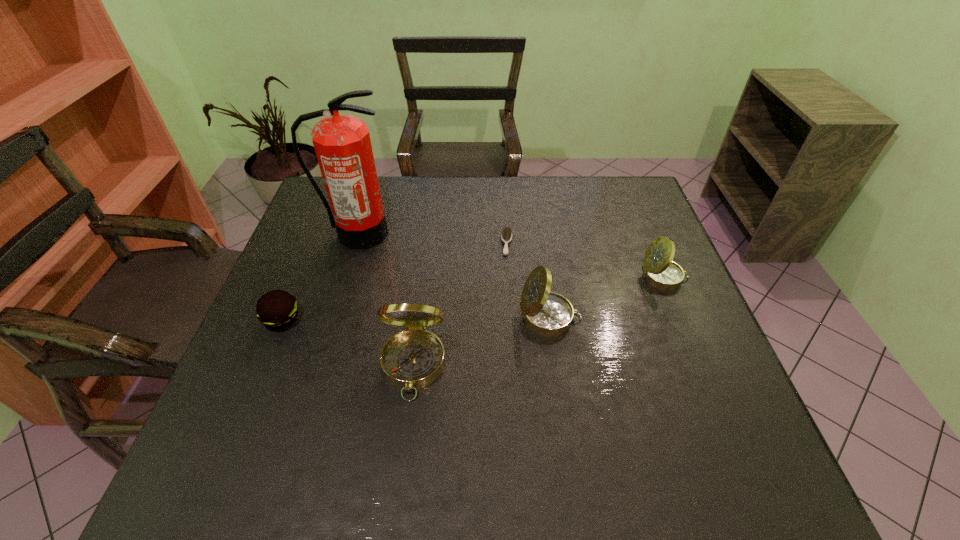
Where is `vacant area situated 0.060m on the front of the third object from right to left`? The width and height of the screenshot is (960, 540). vacant area situated 0.060m on the front of the third object from right to left is located at coordinates (509, 271).

Where is `vacant space located 0.050m on the front side of the tallest object`? The height and width of the screenshot is (540, 960). vacant space located 0.050m on the front side of the tallest object is located at coordinates [349, 261].

Where is `free space located on the front of the fifth tallest object`? free space located on the front of the fifth tallest object is located at coordinates (241, 418).

I want to click on object situated at the far edge, so click(342, 144).

Locate an element on the screen. The width and height of the screenshot is (960, 540). object located at the near edge is located at coordinates (412, 359).

Find the location of `fire extinguisher that is positioned at the left edge`. fire extinguisher that is positioned at the left edge is located at coordinates (342, 144).

Identify the location of patty that is at the left edge. (277, 309).

This screenshot has width=960, height=540. In order to click on object located in the right edge section of the desktop in this screenshot , I will do `click(659, 271)`.

This screenshot has height=540, width=960. Find the location of `object situated at the far left corner`. object situated at the far left corner is located at coordinates (342, 144).

You are a GUI agent. You are given a task and a screenshot of the screen. Output one action in this format:
    pyautogui.click(x=<x>, y=<y>)
    Task: Click on the vacant region at the far edge of the desktop
    This screenshot has height=540, width=960.
    Given the screenshot: What is the action you would take?
    tap(446, 186)